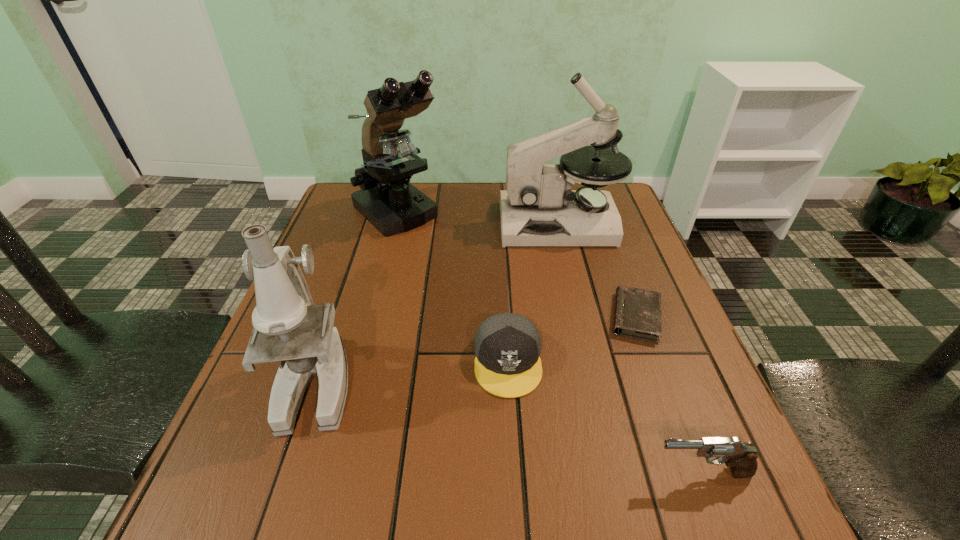
Find the location of a particular element. The height and width of the screenshot is (540, 960). empty space that is in between the rightmost microscope and the pistol is located at coordinates (631, 348).

Locate an element on the screen. This screenshot has height=540, width=960. empty space that is in between the cap and the nearest microscope is located at coordinates [413, 372].

Image resolution: width=960 pixels, height=540 pixels. I want to click on empty location between the nearest microscope and the nearest object, so click(510, 428).

Image resolution: width=960 pixels, height=540 pixels. What are the coordinates of `object that can be found as the fifth closest to the rightmost microscope` in the screenshot? It's located at [741, 458].

The width and height of the screenshot is (960, 540). I want to click on object that is the fourth closest to the diary, so click(x=387, y=200).

You are a GUI agent. You are given a task and a screenshot of the screen. Output one action in this format:
    pyautogui.click(x=<x>, y=<y>)
    Task: Click on the microscope that stands as the closest to the rightmost microscope
    The width and height of the screenshot is (960, 540).
    Given the screenshot: What is the action you would take?
    pyautogui.click(x=387, y=200)

Select which microscope appears as the second closest to the nearest microscope. Please provide its 2D coordinates. Your answer should be formatted as a tuple, i.e. [(x, y)], where the tuple contains the x and y coordinates of a point satisfying the conditions above.

[(538, 208)]

Locate an element on the screen. The width and height of the screenshot is (960, 540). free region that satisfies the following two spatial constraints: 1. at the eyepiece of the rightmost microscope; 2. on the front-facing side of the cap is located at coordinates (592, 361).

You are a GUI agent. You are given a task and a screenshot of the screen. Output one action in this format:
    pyautogui.click(x=<x>, y=<y>)
    Task: Click on the blank area in the image that satisfies the following two spatial constraints: 1. at the eyepiece of the rightmost microscope; 2. on the left side of the shortest object
    The image size is (960, 540).
    Given the screenshot: What is the action you would take?
    pyautogui.click(x=582, y=317)